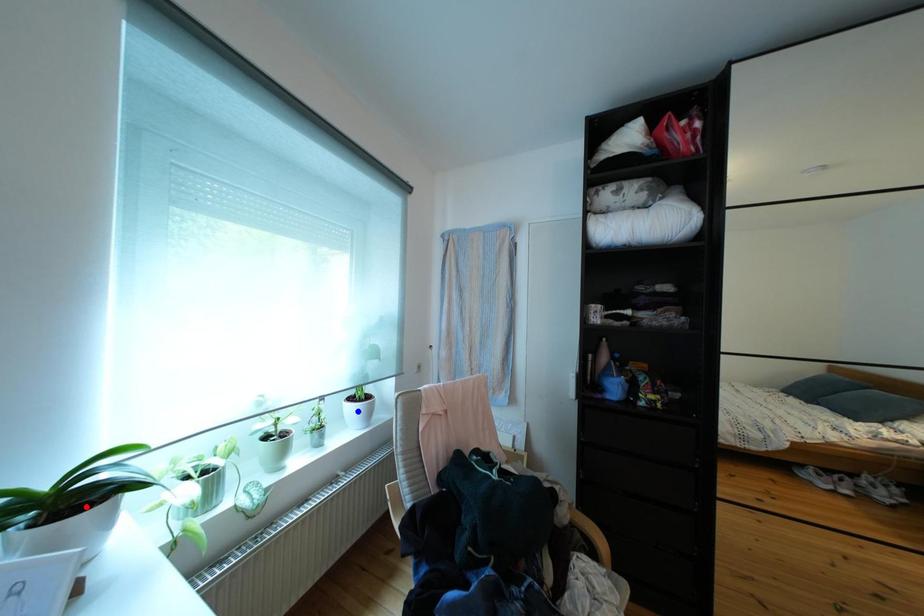
Question: Two points are marked on the image. Which point is closer to the camera?

Choices:
 (A) Blue point is closer.
 (B) Red point is closer.

Answer: (B)